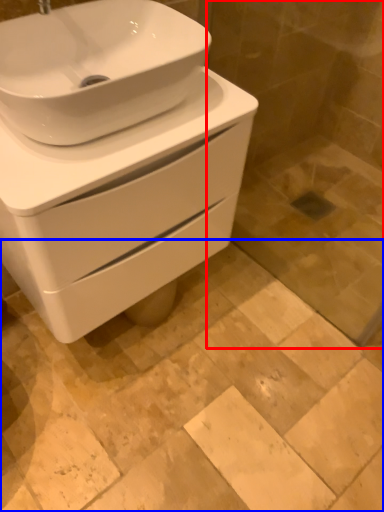
Question: Which point is further to the camera, glass door (highlighted by a red box) or ceramic tile (highlighted by a blue box)?

Choices:
 (A) glass door
 (B) ceramic tile

Answer: (B)